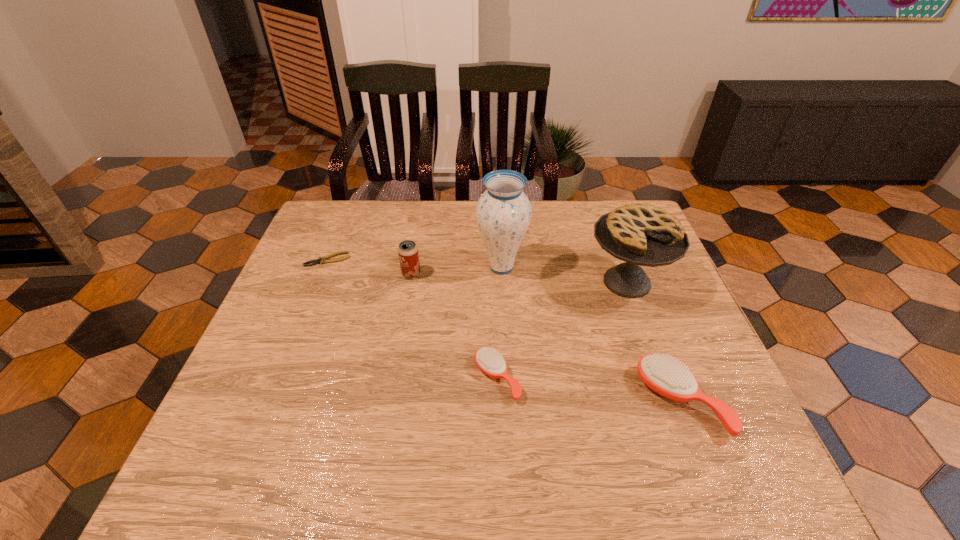
Where is `free space located 0.350m on the left of the shorter hairbrush`? The width and height of the screenshot is (960, 540). free space located 0.350m on the left of the shorter hairbrush is located at coordinates (316, 379).

Identify the location of vacant space positioned 0.370m on the left of the third shortest object. (467, 401).

I want to click on vacant space located on the right of the fifth object from right to left, so click(x=499, y=274).

Locate an element on the screen. This screenshot has width=960, height=540. vacant area situated on the cut side of the second tallest object is located at coordinates (671, 403).

The width and height of the screenshot is (960, 540). Find the location of `free location located on the right of the pliers`. free location located on the right of the pliers is located at coordinates (422, 260).

Identify the location of free region located 0.110m on the back of the vase. The height and width of the screenshot is (540, 960). (499, 230).

Where is `object present at the left edge`? The width and height of the screenshot is (960, 540). object present at the left edge is located at coordinates (321, 260).

At what (x,y) coordinates should I click in order to perform the action: click on hairbrush at the right edge. Please return your answer as a coordinate pair (x, y). This screenshot has height=540, width=960. Looking at the image, I should click on (668, 378).

This screenshot has height=540, width=960. Find the location of `pie present at the right edge`. pie present at the right edge is located at coordinates (640, 234).

Identify the location of object present at the near right corner. The width and height of the screenshot is (960, 540). (668, 378).